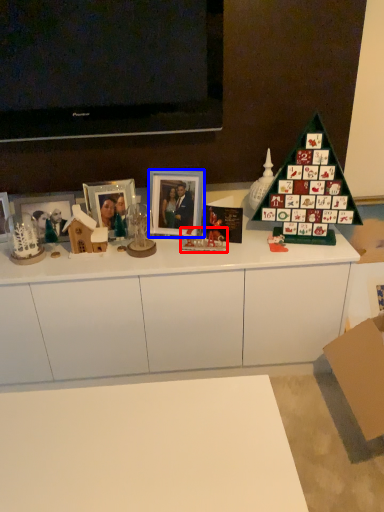
Question: Which point is further to the camera, toy (highlighted by a red box) or picture frame (highlighted by a blue box)?

Choices:
 (A) toy
 (B) picture frame

Answer: (B)